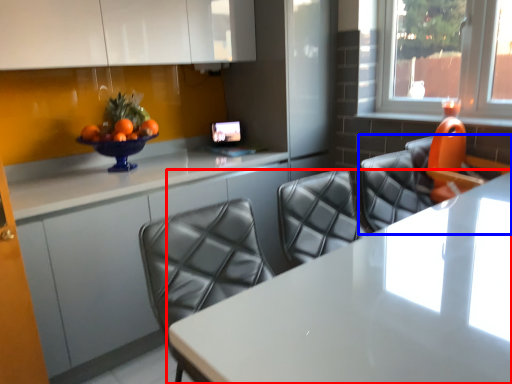
Question: Which object is further to the camera taking this photo, table (highlighted by a red box) or chair (highlighted by a blue box)?

Choices:
 (A) table
 (B) chair

Answer: (B)